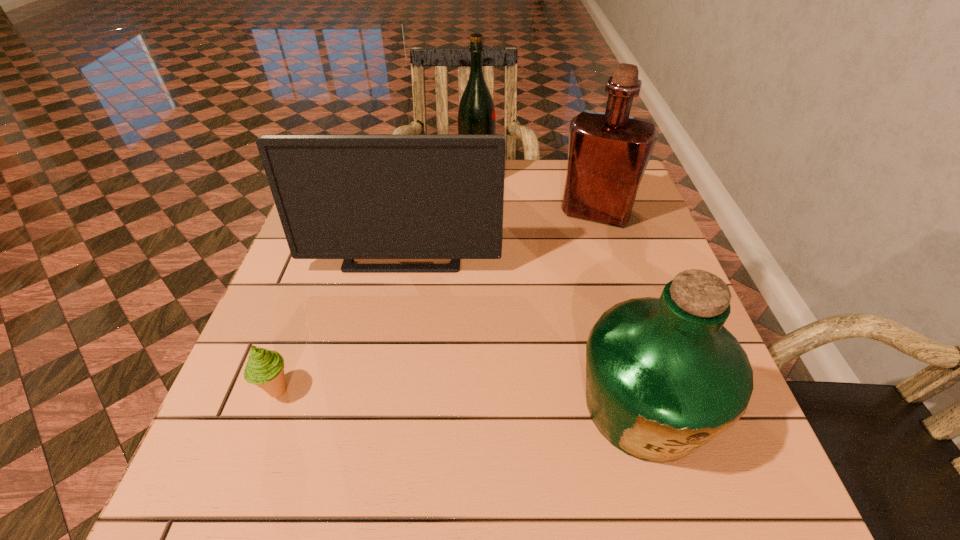
Where is `the leftmost liquor`? the leftmost liquor is located at coordinates (476, 115).

Find the location of a particular element. The height and width of the screenshot is (540, 960). the farthest object is located at coordinates (476, 115).

Locate an element on the screen. the second nearest liquor is located at coordinates (608, 153).

The width and height of the screenshot is (960, 540). Identify the location of computer monitor. (339, 196).

The image size is (960, 540). What are the coordinates of `the shortest liquor` in the screenshot? It's located at (x=664, y=377).

Locate an element on the screen. icecream is located at coordinates (265, 368).

Find the location of a particular element. free location located on the front-facing side of the leftmost liquor is located at coordinates (607, 179).

Find the location of `free spot located 0.160m on the back of the second nearest liquor`. free spot located 0.160m on the back of the second nearest liquor is located at coordinates (581, 165).

The image size is (960, 540). Find the location of `free space located 0.250m on the screen side of the computer monitor`. free space located 0.250m on the screen side of the computer monitor is located at coordinates (383, 368).

Find the location of `blank space located 0.050m on the label side of the shortest liquor`. blank space located 0.050m on the label side of the shortest liquor is located at coordinates [x=674, y=512].